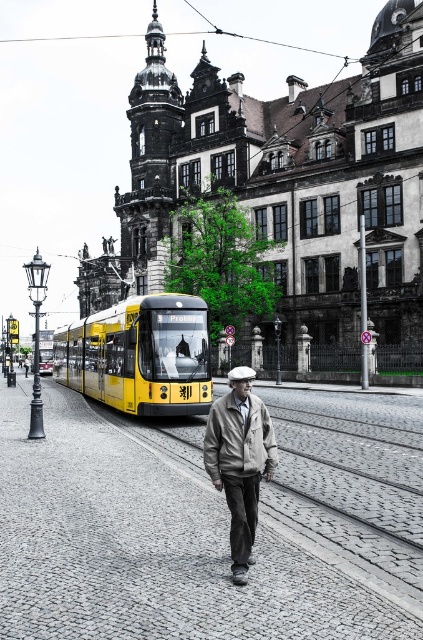
Question: Which point is farther to the camera?

Choices:
 (A) (x=80, y=353)
 (B) (x=219, y=436)

Answer: (A)

Question: Can you confirm if yellow matte bus at center is positioned below khaki fabric jacket at center?

Choices:
 (A) yes
 (B) no

Answer: (B)

Question: Among these points, which one is farthest from the camera?

Choices:
 (A) (249, 401)
 (B) (147, 388)

Answer: (B)

Question: Is yellow matte bus at center positioned at the back of khaki fabric jacket at center?

Choices:
 (A) yes
 (B) no

Answer: (A)

Question: Does yellow matte bus at center appear under khaki fabric jacket at center?

Choices:
 (A) no
 (B) yes

Answer: (A)

Question: Which of the following is the closest to the observer?

Choices:
 (A) yellow matte bus at center
 (B) khaki fabric jacket at center

Answer: (B)